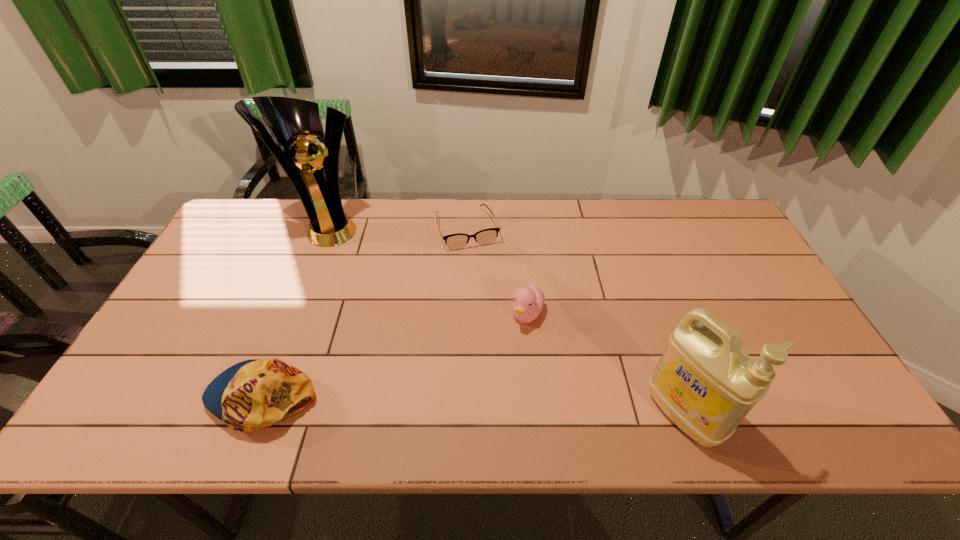
Locate an element on the screen. vacant space located 0.060m on the bill of the cap is located at coordinates (182, 396).

The width and height of the screenshot is (960, 540). Find the location of `vacant space located 0.230m on the back of the rightmost object`. vacant space located 0.230m on the back of the rightmost object is located at coordinates coord(647,306).

Identify the location of blank area located 0.080m at the front of the tallest object, where the globe is visible. (357, 257).

Find the location of a particular element. free spot located at the front of the tallest object, where the globe is visible is located at coordinates (397, 303).

Where is `vacant space positioned at the front of the tallest object, where the globe is visible`? vacant space positioned at the front of the tallest object, where the globe is visible is located at coordinates (352, 252).

Image resolution: width=960 pixels, height=540 pixels. I want to click on vacant space located on the front-facing side of the third farthest object, so click(x=512, y=354).

I want to click on vacant point located 0.090m on the front-facing side of the third farthest object, so click(511, 357).

Locate an element on the screen. free space located on the front-facing side of the third farthest object is located at coordinates (494, 393).

Where is `free space located 0.070m on the face of the spectacles`? The width and height of the screenshot is (960, 540). free space located 0.070m on the face of the spectacles is located at coordinates (480, 267).

In order to click on blank space located on the face of the spectacles in this screenshot , I will do `click(500, 322)`.